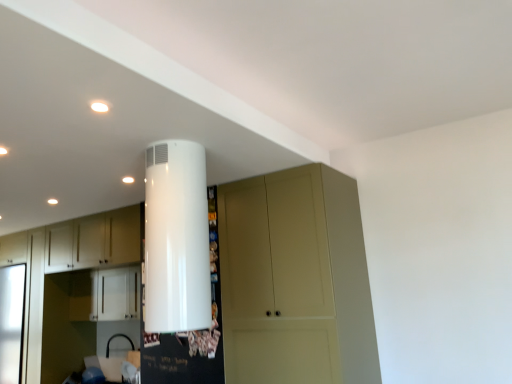
Question: From the image's perspective, is matte beige cupboard at center positioned above or below white matte cabinet at left, the first cabinetry when ordered from left to right?

Choices:
 (A) below
 (B) above

Answer: (B)

Question: Relative to white matte cabinet at left, the first cabinetry when ordered from left to right, is matte beige cupboard at center in front or behind?

Choices:
 (A) front
 (B) behind

Answer: (A)

Question: Which of these objects is positioned farthest from the white matte cabinet at left, marked as the second cabinetry in a right-to-left arrangement?

Choices:
 (A) white glossy water heater at upper center
 (B) matte beige cupboard at center
 (C) white glossy cabinet at center, the 2th cabinetry viewed from the left

Answer: (A)

Question: Estimate the real-world distances between objects in this image. Which object is closer to the white matte cabinet at left, the first cabinetry when ordered from left to right?

Choices:
 (A) white glossy water heater at upper center
 (B) white glossy cabinet at center, which is the 1th cabinetry in right-to-left order
 (C) matte beige cupboard at center

Answer: (B)